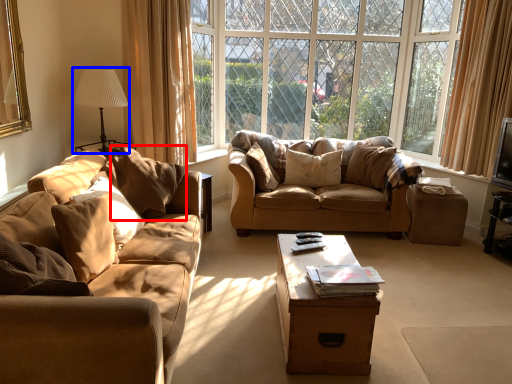
Question: Which of the following is the closest to the observer, pillow (highlighted by a red box) or lamp (highlighted by a blue box)?

Choices:
 (A) pillow
 (B) lamp

Answer: (A)